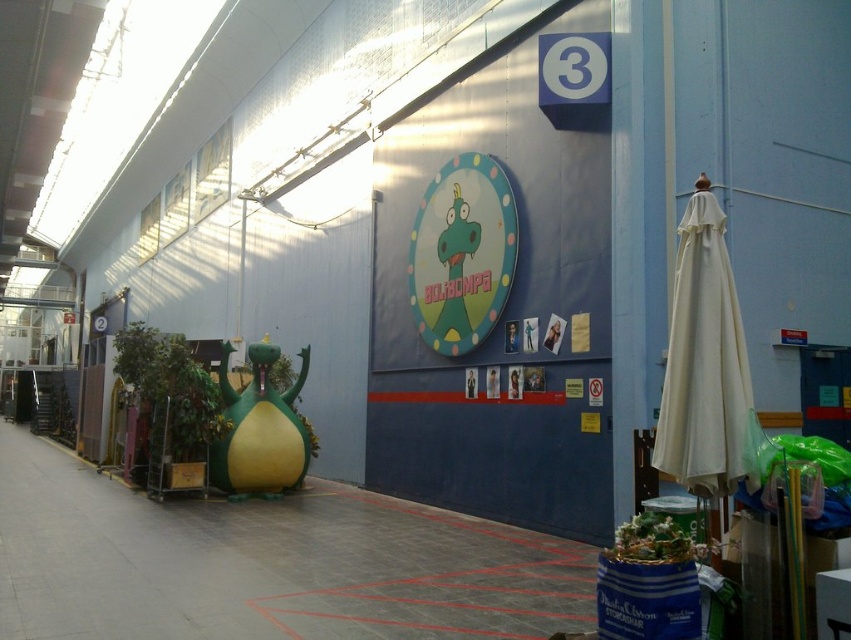
Can you confirm if matte blue bulletin board at center is bigger than matte plastic clock at center?

Incorrect, matte blue bulletin board at center is not larger than matte plastic clock at center.

Who is more distant from viewer, [561,400] or [506,225]?

The point [506,225] is behind.

Describe the element at coordinates (500, 314) in the screenshot. I see `matte blue bulletin board at center` at that location.

Find the location of a particular element. This screenshot has height=640, width=851. matte blue bulletin board at center is located at coordinates (500, 314).